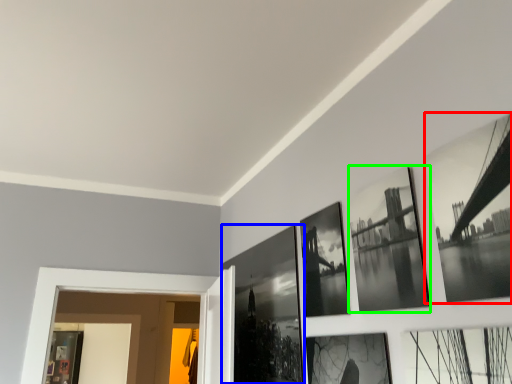
Question: Which object is the farthest from picture frame (highlighted by a red box)? Choose among these: picture frame (highlighted by a blue box) or picture frame (highlighted by a green box).

Choices:
 (A) picture frame
 (B) picture frame

Answer: (A)